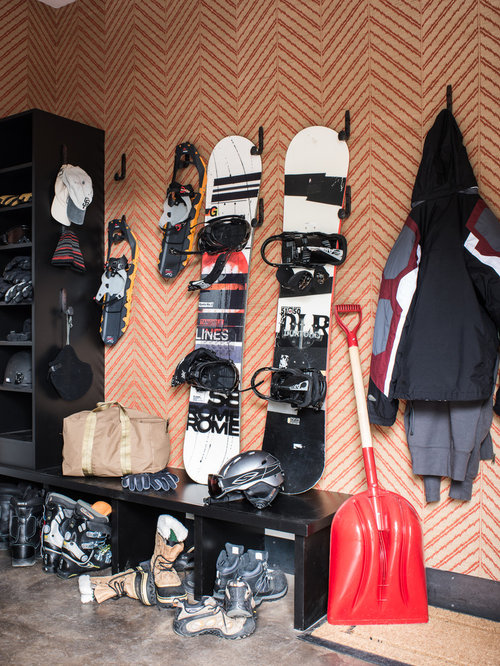
The height and width of the screenshot is (666, 500). I want to click on mat, so click(x=428, y=651).